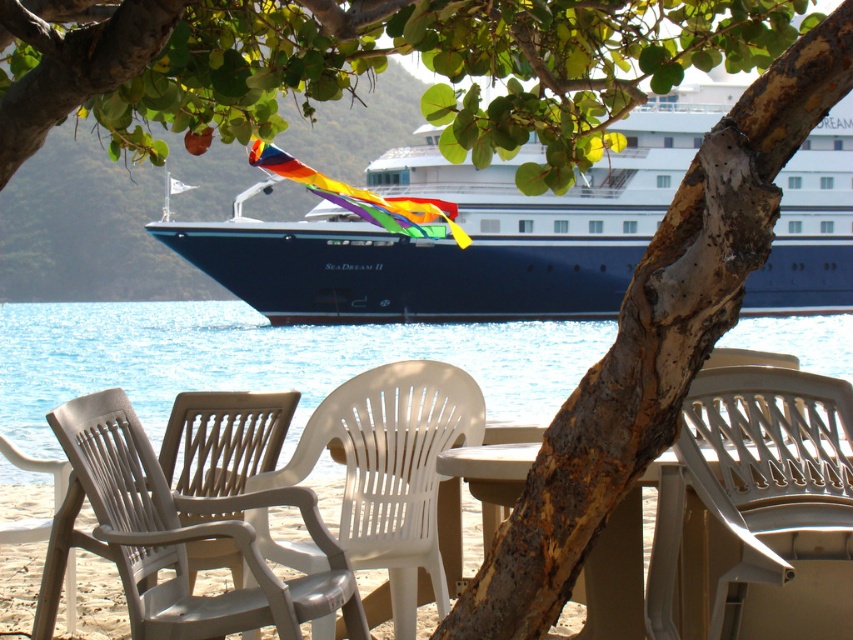
Who is higher up, transparent plastic water at center or white plastic chair at center?

transparent plastic water at center is higher up.

Does transparent plastic water at center have a smaller size compared to white plastic chair at center?

Incorrect, transparent plastic water at center is not smaller in size than white plastic chair at center.

Is point (57, 305) farther from camera compared to point (422, 481)?

Yes, it is behind point (422, 481).

The height and width of the screenshot is (640, 853). Find the location of `transparent plastic water at center`. transparent plastic water at center is located at coordinates (260, 358).

Does point (824, 321) lie behind point (334, 573)?

Yes, point (824, 321) is farther from viewer.

Does transparent plastic water at center have a greater height compared to white plastic beach chair at lower center?

Yes.

I want to click on transparent plastic water at center, so click(x=260, y=358).

Who is lower down, blue glossy cruise ship at center or white plastic chair at lower right?

white plastic chair at lower right

Between blue glossy cruise ship at center and white plastic chair at lower right, which one appears on the left side from the viewer's perspective?

white plastic chair at lower right

Describe the element at coordinates (468, 230) in the screenshot. I see `blue glossy cruise ship at center` at that location.

I want to click on blue glossy cruise ship at center, so click(x=468, y=230).